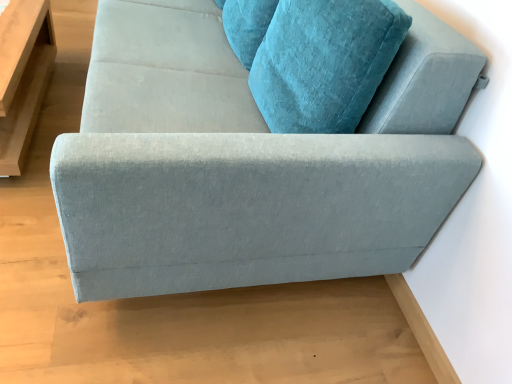
Describe the element at coordinates (249, 162) in the screenshot. The height and width of the screenshot is (384, 512). I see `matte gray couch at center` at that location.

Measure the distance between matte gray couch at center and camera.

matte gray couch at center is 32.70 inches from camera.

In order to click on matte gray couch at center in this screenshot , I will do `click(249, 162)`.

Where is `light brown wooden table at left`? light brown wooden table at left is located at coordinates (23, 76).

This screenshot has height=384, width=512. Describe the element at coordinates (23, 76) in the screenshot. I see `light brown wooden table at left` at that location.

Where is `matte gray couch at center`? The width and height of the screenshot is (512, 384). matte gray couch at center is located at coordinates (249, 162).

Considering the relative positions of light brown wooden table at left and matte gray couch at center in the image provided, is light brown wooden table at left to the left or to the right of matte gray couch at center?

light brown wooden table at left is to the left of matte gray couch at center.

Considering the positions of objects light brown wooden table at left and matte gray couch at center in the image provided, who is in front, light brown wooden table at left or matte gray couch at center?

matte gray couch at center is in front.

Is point (5, 113) positioned in front of point (415, 210)?

No.

From the image's perspective, is light brown wooden table at left positioned above or below matte gray couch at center?

light brown wooden table at left is below matte gray couch at center.

From a real-world perspective, between light brown wooden table at left and matte gray couch at center, who is vertically higher?

matte gray couch at center.

Between light brown wooden table at left and matte gray couch at center, which one has smaller width?

With smaller width is light brown wooden table at left.

Who is shorter, light brown wooden table at left or matte gray couch at center?

light brown wooden table at left is shorter.

Who is bigger, light brown wooden table at left or matte gray couch at center?

Bigger between the two is matte gray couch at center.

Is light brown wooden table at left not within matte gray couch at center?

light brown wooden table at left is positioned outside matte gray couch at center.

Is light brown wooden table at left placed right next to matte gray couch at center?

light brown wooden table at left and matte gray couch at center are not in contact.

Is light brown wooden table at left oriented away from matte gray couch at center?

Yes, light brown wooden table at left is facing away from matte gray couch at center.

Can you tell me how much light brown wooden table at left and matte gray couch at center differ in facing direction?

The facing directions of light brown wooden table at left and matte gray couch at center are 6.14e-05 degrees apart.

Locate an element on the screen. studio couch in front of the light brown wooden table at left is located at coordinates (249, 162).

Considering the relative positions of matte gray couch at center and light brown wooden table at left in the image provided, is matte gray couch at center to the left or to the right of light brown wooden table at left?

Clearly, matte gray couch at center is on the right of light brown wooden table at left in the image.

Is the depth of matte gray couch at center greater than that of light brown wooden table at left?

No, it is not.

Is point (211, 124) positioned behind point (42, 94)?

No, (211, 124) is in front of (42, 94).

From the image's perspective, is matte gray couch at center beneath light brown wooden table at left?

No, from the image's perspective, matte gray couch at center is not below light brown wooden table at left.

From a real-world perspective, who is located lower, matte gray couch at center or light brown wooden table at left?

From a 3D spatial view, light brown wooden table at left is below.

Can you confirm if matte gray couch at center is thinner than light brown wooden table at left?

No, matte gray couch at center is not thinner than light brown wooden table at left.

Who is shorter, matte gray couch at center or light brown wooden table at left?

With less height is light brown wooden table at left.

From the picture: In terms of size, does matte gray couch at center appear bigger or smaller than light brown wooden table at left?

Considering their sizes, matte gray couch at center takes up more space than light brown wooden table at left.

Would you say matte gray couch at center contains light brown wooden table at left?

No, light brown wooden table at left is not surrounded by matte gray couch at center.

Is there a large distance between matte gray couch at center and light brown wooden table at left?

Absolutely, matte gray couch at center is distant from light brown wooden table at left.

Could you tell me if matte gray couch at center is turned towards light brown wooden table at left?

Yes, matte gray couch at center is facing light brown wooden table at left.

From the picture: How many degrees apart are the facing directions of matte gray couch at center and light brown wooden table at left?

6.14e-05 degrees separate the facing orientations of matte gray couch at center and light brown wooden table at left.

Where is `studio couch on the right side of light brown wooden table at left`? The image size is (512, 384). studio couch on the right side of light brown wooden table at left is located at coordinates (249, 162).

What are the coordinates of `table on the left of matte gray couch at center` in the screenshot? It's located at coord(23,76).

The height and width of the screenshot is (384, 512). What are the coordinates of `table lying below the matte gray couch at center (from the image's perspective)` in the screenshot? It's located at (x=23, y=76).